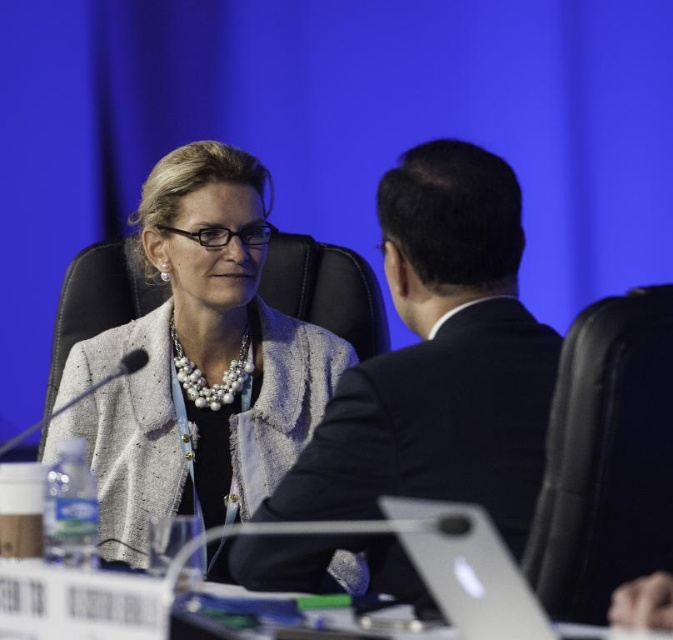
What do you see at coordinates (197, 362) in the screenshot? This screenshot has width=673, height=640. I see `matte gray blazer at center` at bounding box center [197, 362].

Is matte gray blazer at center further to camera compared to silver metallic laptop at center?

Yes, matte gray blazer at center is further from the viewer.

Is point (162, 412) less distant than point (503, 611)?

No, (162, 412) is behind (503, 611).

Image resolution: width=673 pixels, height=640 pixels. In order to click on matte gray blazer at center in this screenshot , I will do `click(197, 362)`.

Is dark suit at center further to camera compared to matte gray blazer at center?

No, dark suit at center is in front of matte gray blazer at center.

From the picture: Can you confirm if dark suit at center is taller than matte gray blazer at center?

No, dark suit at center is not taller than matte gray blazer at center.

Where is `dark suit at center`? This screenshot has height=640, width=673. dark suit at center is located at coordinates 439,358.

Can you confirm if dark suit at center is positioned above silver metallic laptop at center?

Indeed, dark suit at center is positioned over silver metallic laptop at center.

Can you confirm if dark suit at center is wider than silver metallic laptop at center?

Yes, dark suit at center is wider than silver metallic laptop at center.

Locate an element on the screen. dark suit at center is located at coordinates (439, 358).

At what (x,y) coordinates should I click in order to perform the action: click on dark suit at center. Please return your answer as a coordinate pair (x, y). Image resolution: width=673 pixels, height=640 pixels. Looking at the image, I should click on (439, 358).